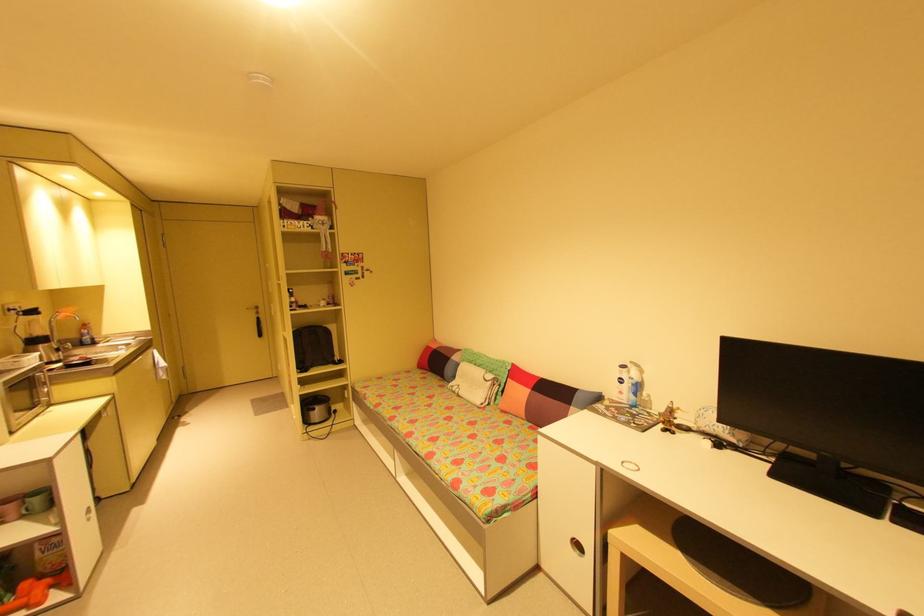
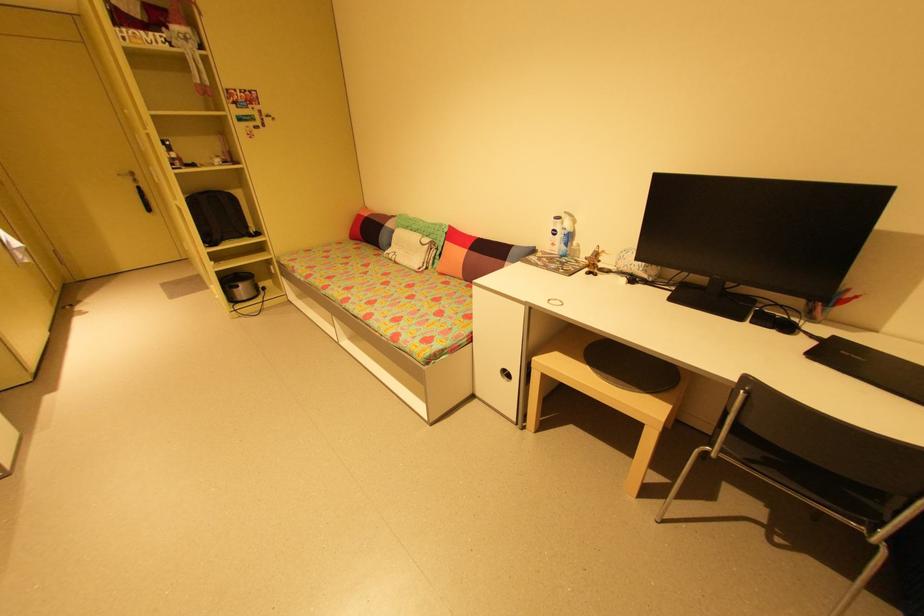
In the second image, find the point that corresponds to the point at 439,347 in the first image.

(371, 215)